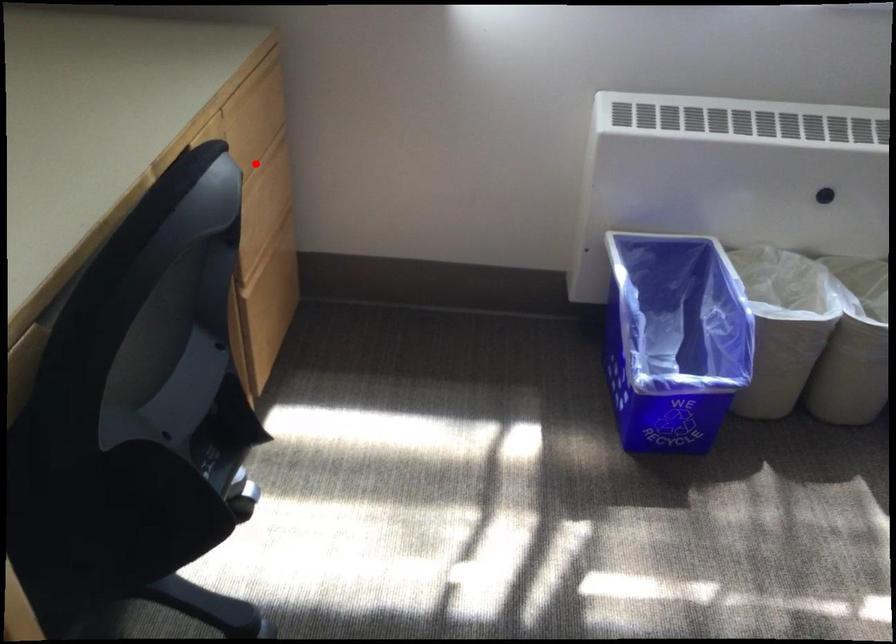
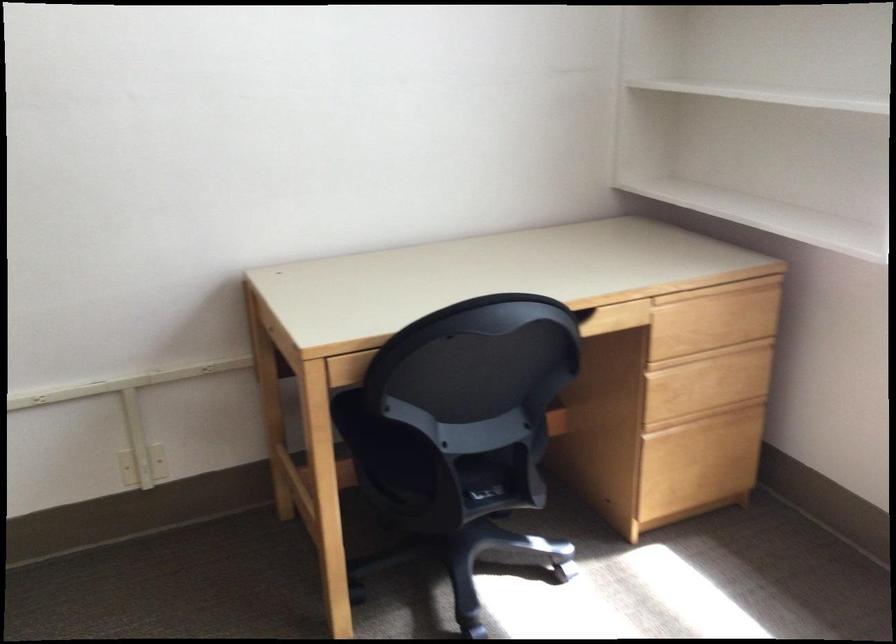
Find the pixel in the second image that matches the highlighted location in the first image.

(700, 346)